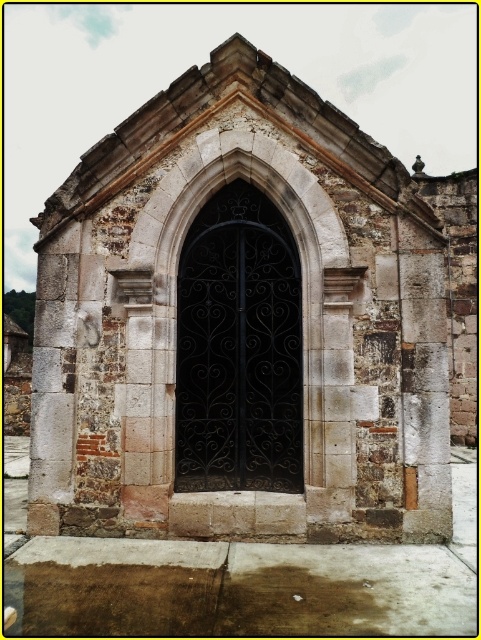
Question: Which point is farther to the camera?

Choices:
 (A) (249, 396)
 (B) (250, 192)

Answer: (B)

Question: Which object is farther from the camera taking this photo?

Choices:
 (A) black wrought iron door at center
 (B) stone arched door at center

Answer: (A)

Question: Can you confirm if stone arched door at center is positioned to the left of black wrought iron door at center?

Choices:
 (A) yes
 (B) no

Answer: (B)

Question: Does stone arched door at center have a greater width compared to black wrought iron door at center?

Choices:
 (A) yes
 (B) no

Answer: (B)

Question: Does stone arched door at center have a greater width compared to black wrought iron door at center?

Choices:
 (A) yes
 (B) no

Answer: (B)